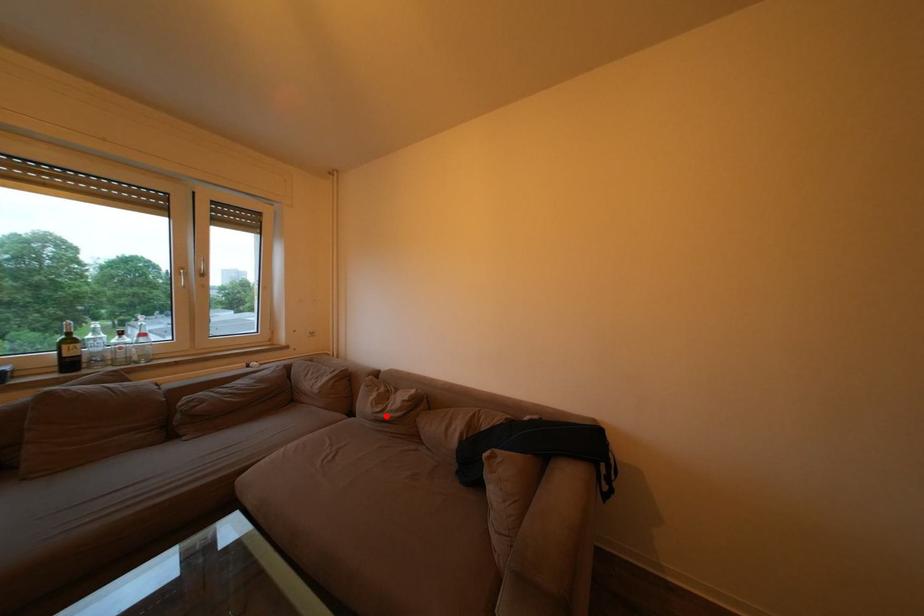
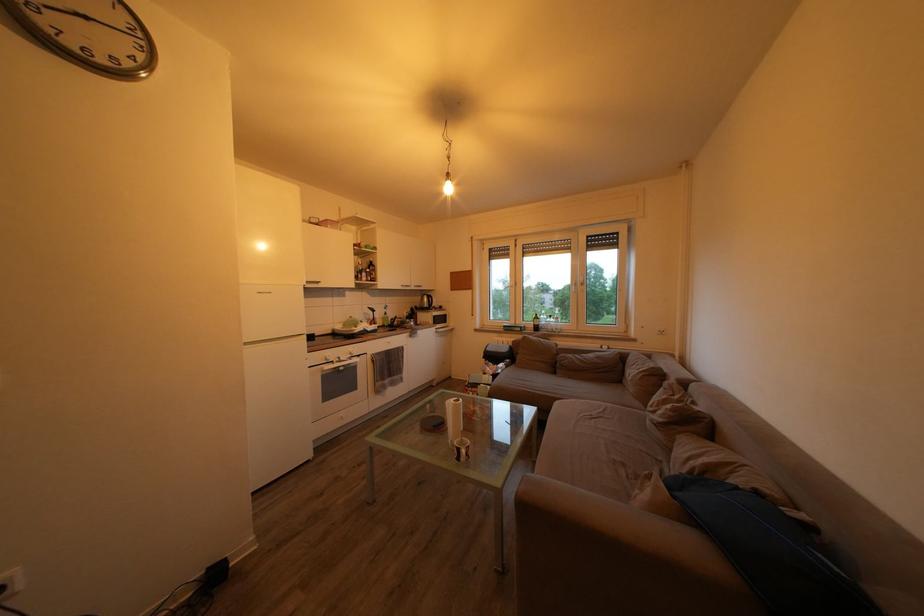
Locate, in the second image, the point that corresponds to the highlighted location in the first image.

(659, 416)